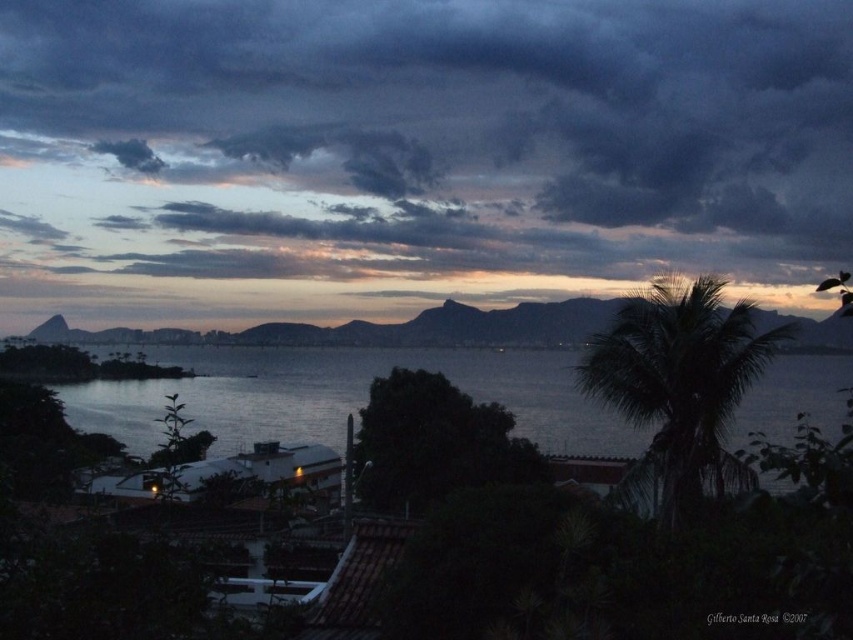
You are an astronomer observing the night sky from a coastal area. You notice a dark gray cloud at upper center and a silvery metallic water at center. Which object is positioned to the right side of the other?

The dark gray cloud at upper center is positioned to the right of the silvery metallic water at center.

You are standing on the coast looking at the scene. There is a point marked at coordinates point (x=422, y=140). What object is located at that point?

The point (x=422, y=140) indicates a dark gray cloud at upper center.